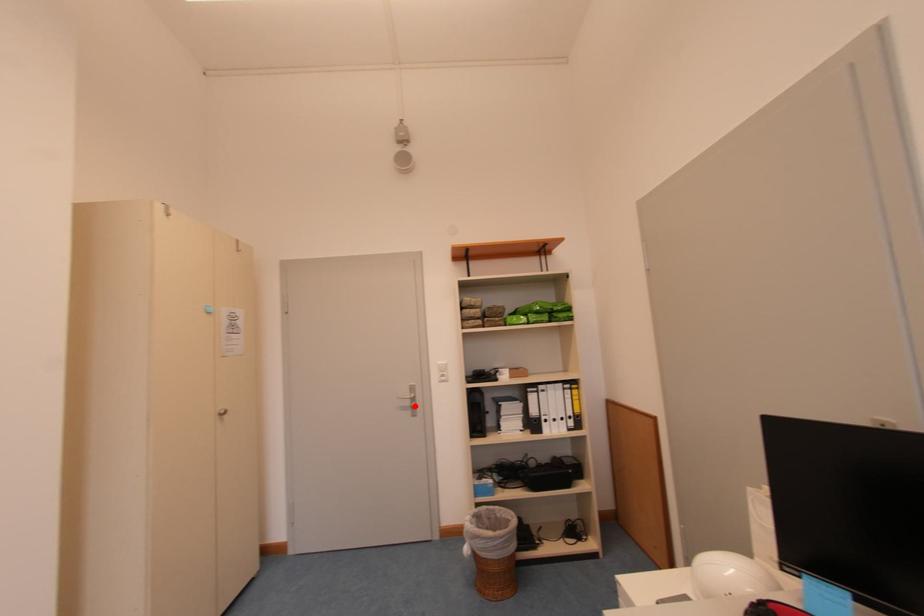
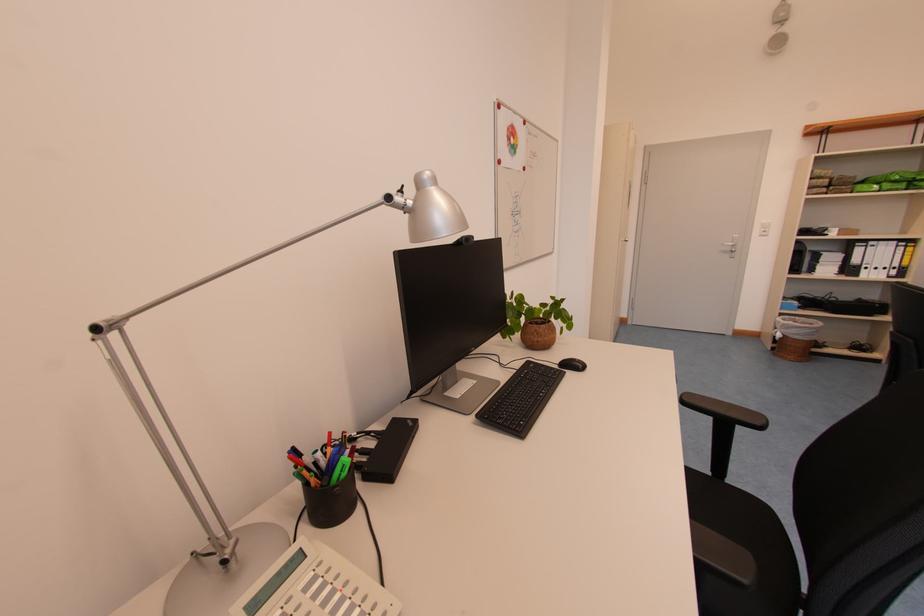
Question: I am providing you with two images of the same scene from different viewpoints. Given a red point in image1, look at the same physical point in image2. Is it:

Choices:
 (A) Closer to the viewpoint
 (B) Farther from the viewpoint

Answer: (A)